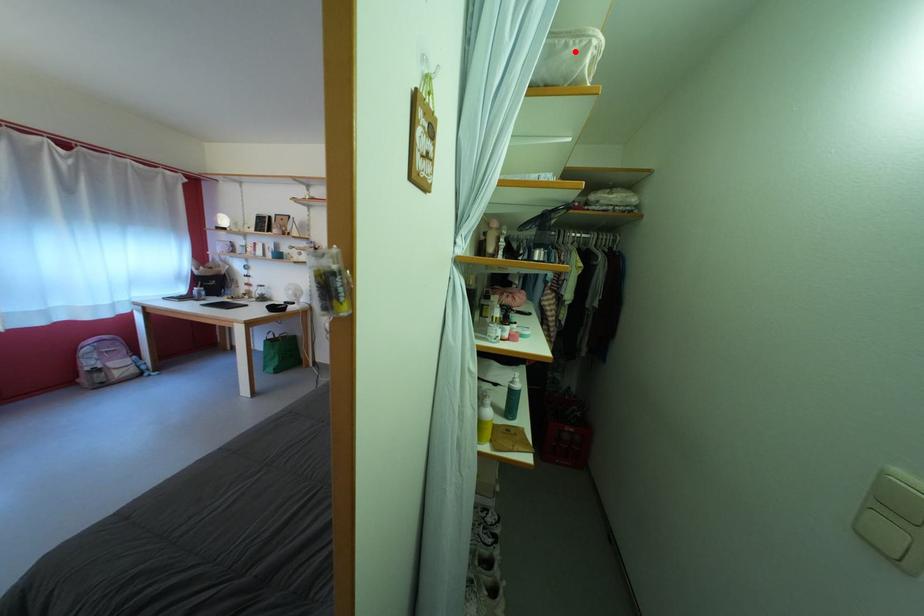
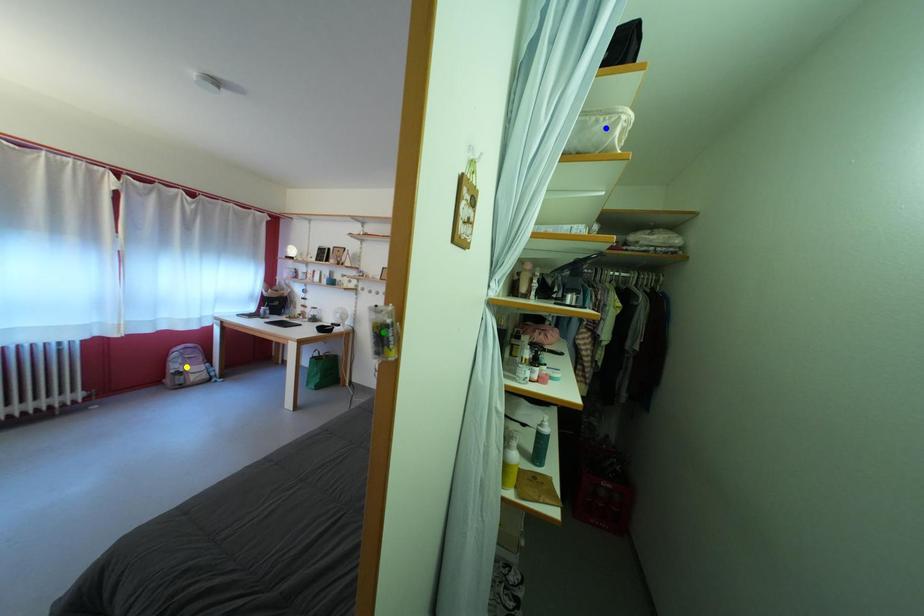
Question: I am providing you with two images of the same scene from different viewpoints. A red point is marked on the first image. You are given multiple points on the second image. Which mark in image 2 goes with the point in image 1?

Choices:
 (A) green point
 (B) yellow point
 (C) blue point

Answer: (C)